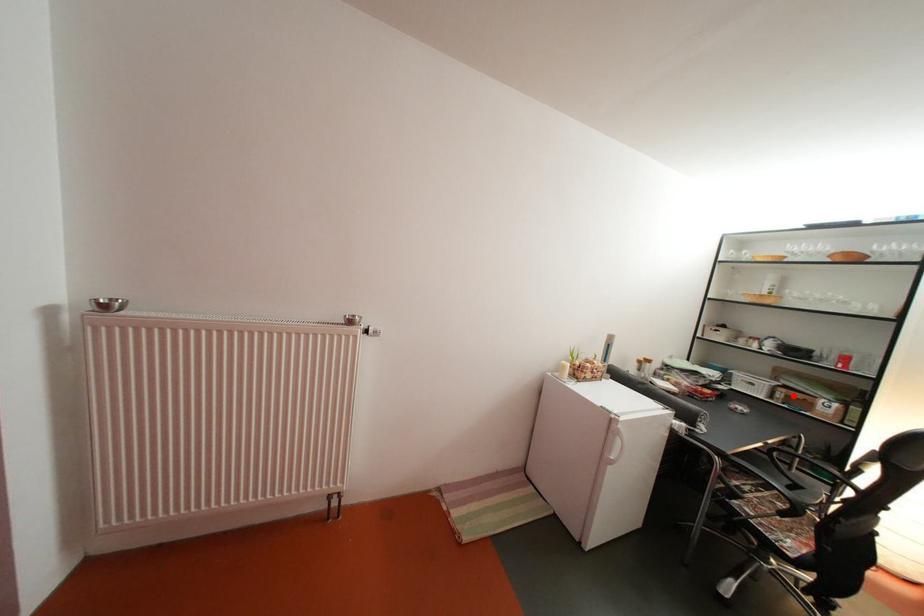
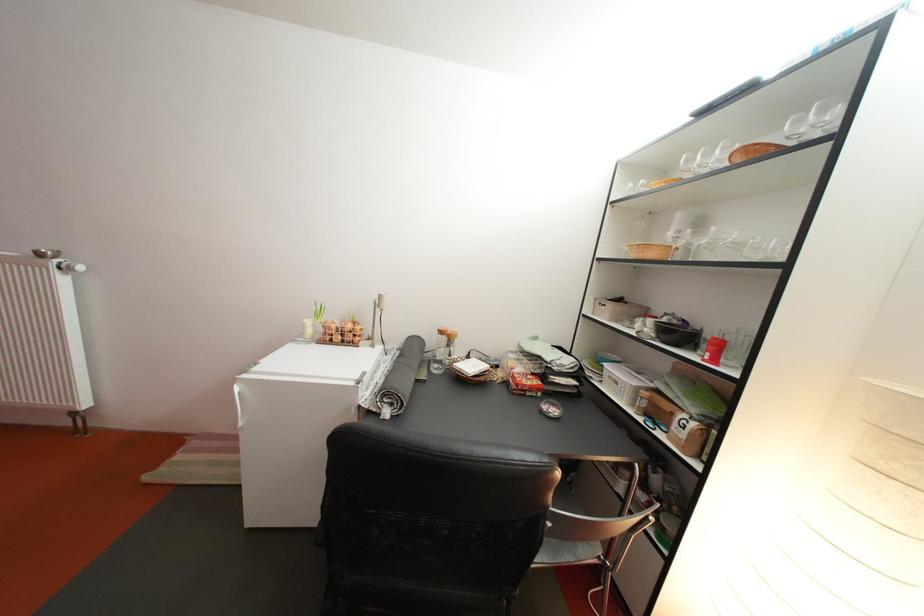
The point at the highlighted location is marked in the first image. Where is the corresponding point in the second image?

(658, 400)